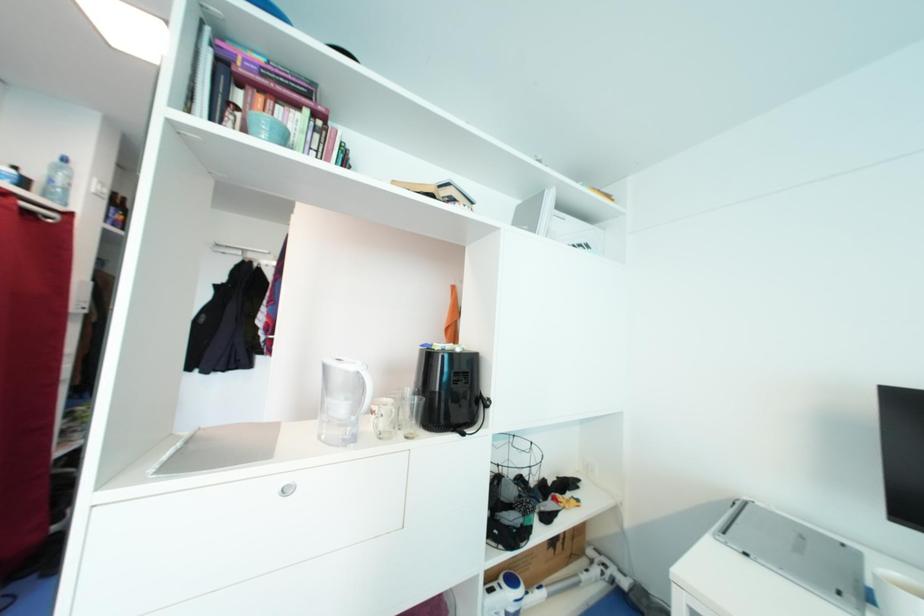
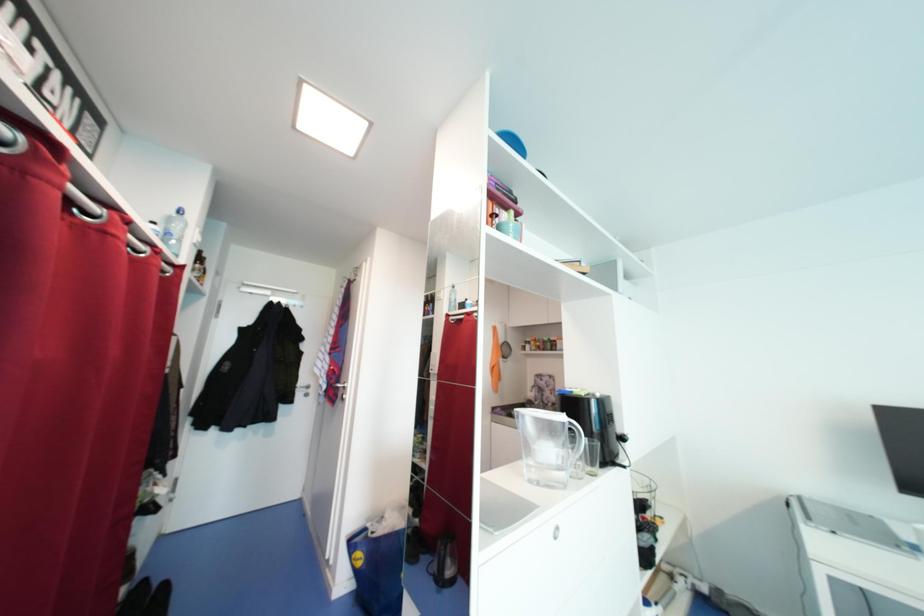
Question: The first image is from the beginning of the video and the second image is from the end. How did the camera likely rotate when shooting the video?

Choices:
 (A) Left
 (B) Right
 (C) Up
 (D) Down

Answer: (B)